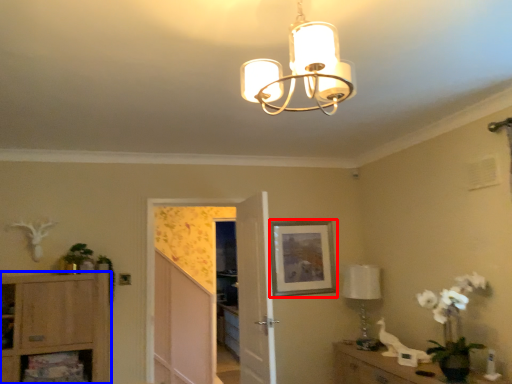
Question: Which object is further to the camera taking this photo, picture frame (highlighted by a red box) or cabinetry (highlighted by a blue box)?

Choices:
 (A) picture frame
 (B) cabinetry

Answer: (A)